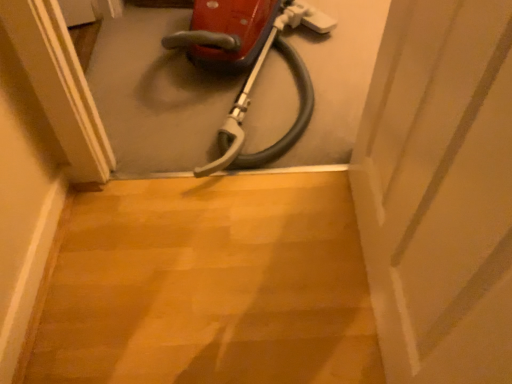
Where is `red plastic vacuum cleaner at center`? This screenshot has width=512, height=384. red plastic vacuum cleaner at center is located at coordinates (250, 63).

What do you see at coordinates (250, 63) in the screenshot? The width and height of the screenshot is (512, 384). I see `red plastic vacuum cleaner at center` at bounding box center [250, 63].

This screenshot has height=384, width=512. Identify the location of red plastic vacuum cleaner at center. (250, 63).